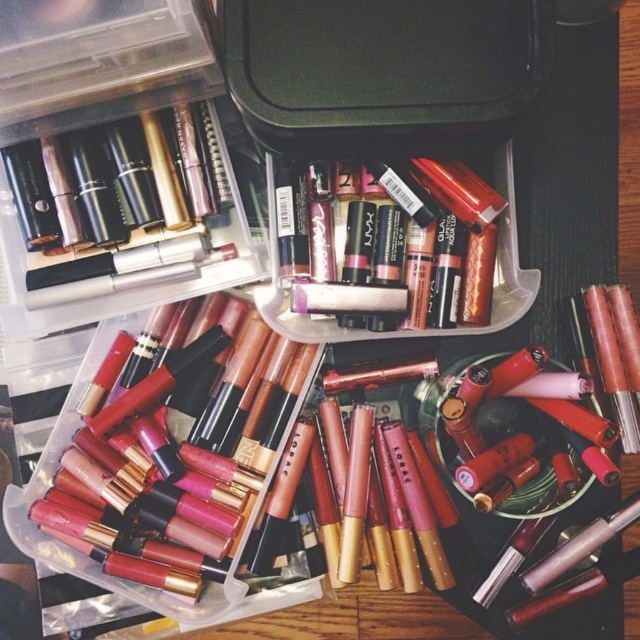
From the picture: You have two gold lipsticks in your collection. One is the matte gold lipstick at lower left and the other is the metallic gold lipstick at center. Which one is larger in size?

Answer: The matte gold lipstick at lower left is bigger than the metallic gold lipstick at center.

You are organizing your makeup collection and see the matte gold lipstick at lower left and the metallic gold lipstick at center. Which one is positioned more to the left?

The matte gold lipstick at lower left is positioned more to the left than the metallic gold lipstick at center.

What is located at the coordinates point (195, 444) in the image?

The point (195, 444) corresponds to the matte gold lipstick at lower left.